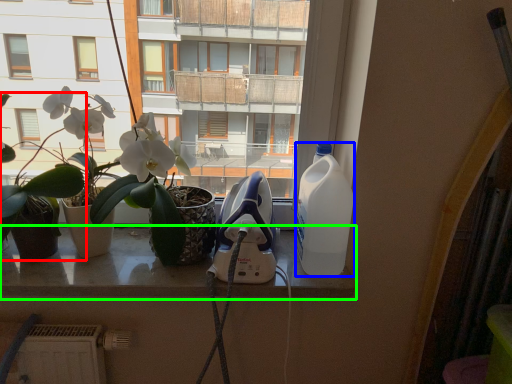
Question: Estimate the real-world distances between objects in this image. Which object is farther from houseplant (highlighted by a red box), bottle (highlighted by a blue box) or window (highlighted by a green box)?

Choices:
 (A) bottle
 (B) window

Answer: (A)